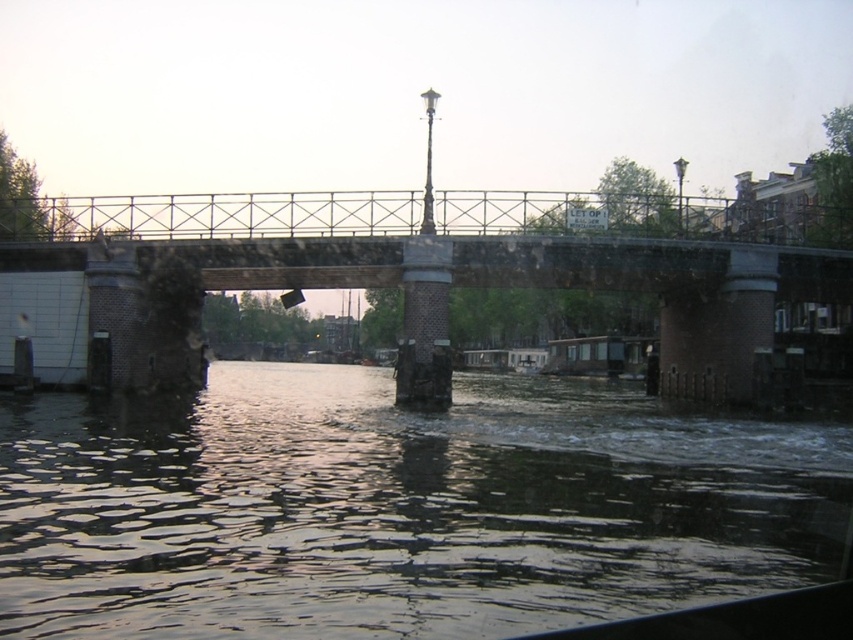
You are standing on the stone bridge and want to take a photo of the dark reflective water at center. Where should you aim your camera to capture it?

You should aim your camera at point (399,508) to capture the dark reflective water at center.

You are a tour guide explaining the canal scene to a group. You mention both the dark reflective water at center and the rusty metal bridge at center. Which object appears narrower in the image?

The dark reflective water at center appears narrower than the rusty metal bridge at center.

You are a tourist in Amsterdam and want to take a photo of the dark reflective water at center without the rusty metal bridge at center appearing in the shot. How can you adjust your position to achieve this?

The dark reflective water at center is positioned under the rusty metal bridge at center. To avoid the bridge in your photo, you can crouch down low so that the bridge railing blocks the view of the bridge itself, allowing you to capture the water reflection below without the bridge obstructing the shot.